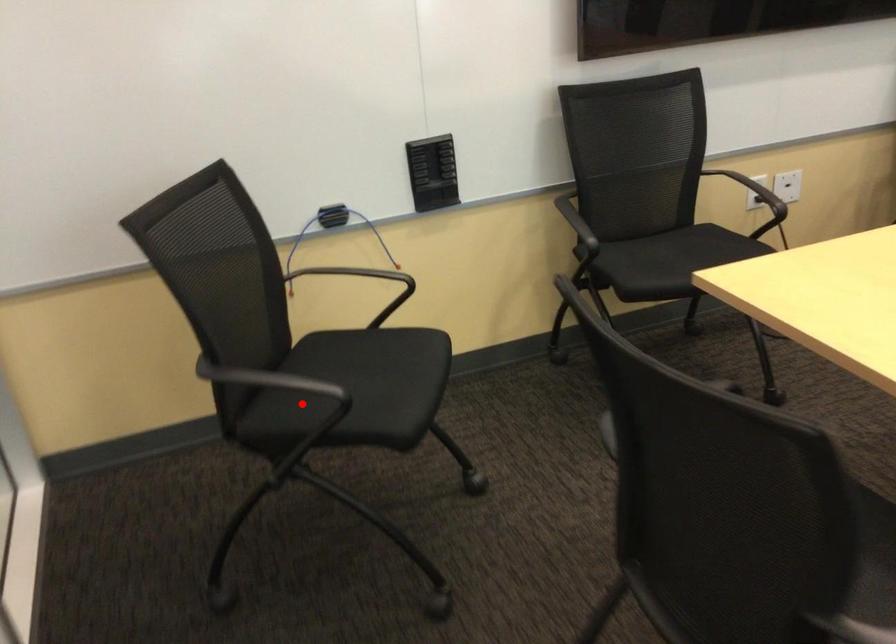
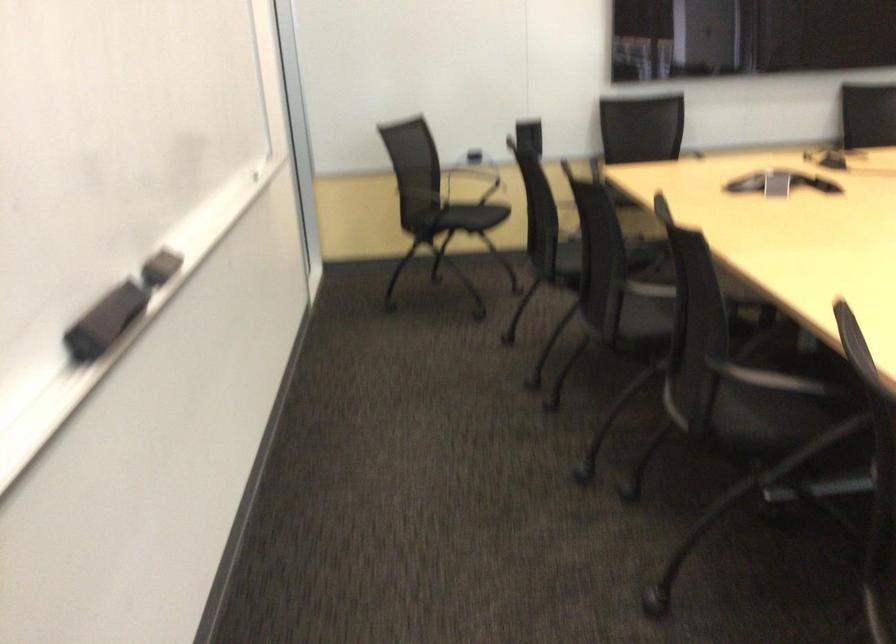
The point at the highlighted location is marked in the first image. Where is the corresponding point in the second image?

(448, 216)